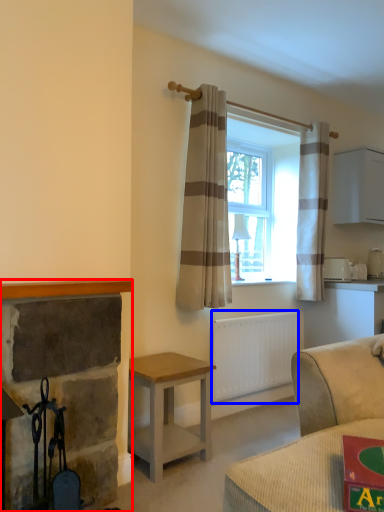
Question: Which object is further to the camera taking this photo, fireplace (highlighted by a red box) or radiator (highlighted by a blue box)?

Choices:
 (A) fireplace
 (B) radiator

Answer: (B)